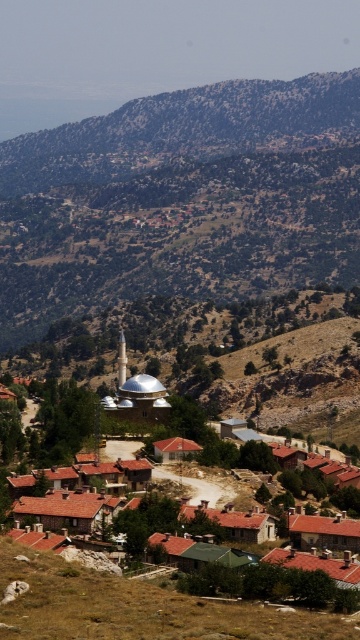
Question: Is brown rocky mountain at upper center bigger than brown tiled roofs at center?

Choices:
 (A) yes
 (B) no

Answer: (A)

Question: Considering the relative positions of brown rocky mountain at upper center and brown tiled roofs at center in the image provided, where is brown rocky mountain at upper center located with respect to brown tiled roofs at center?

Choices:
 (A) above
 (B) below

Answer: (A)

Question: Which point appears closest to the camera in this image?

Choices:
 (A) [261, 131]
 (B) [340, 529]

Answer: (B)

Question: Does brown rocky mountain at upper center appear on the right side of brown tiled roofs at center?

Choices:
 (A) no
 (B) yes

Answer: (A)

Question: Which of the following is the closest to the observer?

Choices:
 (A) brown rocky mountain at upper center
 (B) brown tiled roofs at center

Answer: (B)